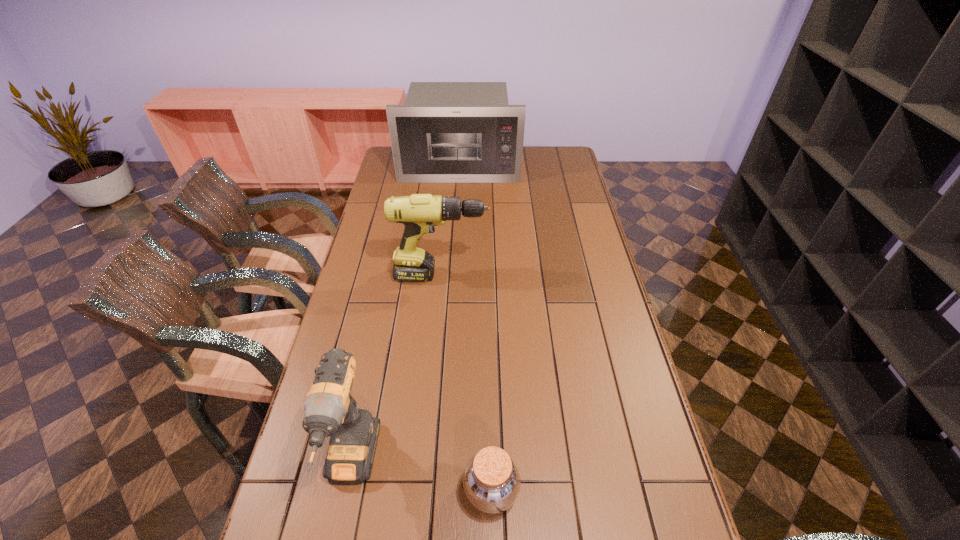
At what (x,y) coordinates should I click in order to perform the action: click on the farthest object. Please return your answer as a coordinate pair (x, y). The height and width of the screenshot is (540, 960). Looking at the image, I should click on (446, 132).

Locate an element on the screen. Image resolution: width=960 pixels, height=540 pixels. the farther drill is located at coordinates (419, 213).

Identify the location of the nearer drill. (330, 410).

At what (x,y) coordinates should I click in order to perform the action: click on the shortest object. Please return your answer as a coordinate pair (x, y). The height and width of the screenshot is (540, 960). Looking at the image, I should click on click(x=491, y=480).

Image resolution: width=960 pixels, height=540 pixels. In order to click on vacant space located 0.170m on the front-facing side of the microwave oven in this screenshot , I will do `click(457, 206)`.

This screenshot has height=540, width=960. What are the coordinates of `vacant space located 0.320m on the handle side of the second farthest object` in the screenshot? It's located at (581, 275).

Locate an element on the screen. This screenshot has width=960, height=540. free space located 0.280m on the left of the jar is located at coordinates (342, 491).

You are a GUI agent. You are given a task and a screenshot of the screen. Output one action in this format:
    pyautogui.click(x=<x>, y=<y>)
    Task: Click on the object present at the far edge
    The image size is (960, 540).
    Given the screenshot: What is the action you would take?
    pyautogui.click(x=446, y=132)

The width and height of the screenshot is (960, 540). I want to click on microwave oven that is at the left edge, so click(x=446, y=132).

You are a GUI agent. You are given a task and a screenshot of the screen. Output one action in this format:
    pyautogui.click(x=<x>, y=<y>)
    Task: Click on the object positioned at the far left corner
    The height and width of the screenshot is (540, 960).
    Given the screenshot: What is the action you would take?
    pyautogui.click(x=446, y=132)